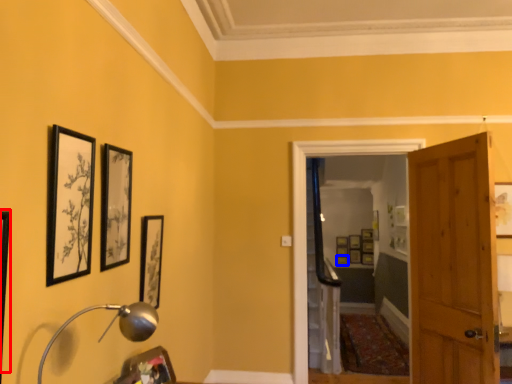
Question: Which object is further to the camera taking this photo, picture frame (highlighted by a red box) or picture frame (highlighted by a blue box)?

Choices:
 (A) picture frame
 (B) picture frame

Answer: (B)